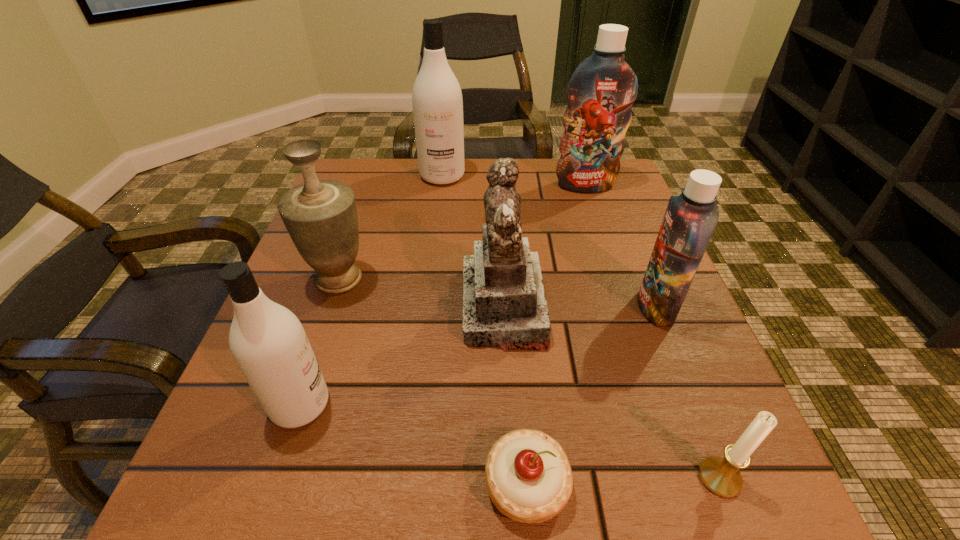
Where is `object that is at the near right corner`? This screenshot has width=960, height=540. object that is at the near right corner is located at coordinates (721, 476).

The image size is (960, 540). What are the coordinates of `free point at the far edge` in the screenshot? It's located at coord(538,167).

This screenshot has height=540, width=960. I want to click on vacant space at the left edge of the desktop, so click(x=382, y=231).

The image size is (960, 540). Identify the location of vacant space at the right edge of the desktop. (604, 282).

The height and width of the screenshot is (540, 960). Find the location of `vacant space at the near left corner`. vacant space at the near left corner is located at coordinates (263, 506).

Where is `free point between the figurine and the bigger white shampoo`? This screenshot has height=540, width=960. free point between the figurine and the bigger white shampoo is located at coordinates (473, 241).

Locate an element on the screen. free space between the smaller blue shampoo and the nearer white shampoo is located at coordinates (478, 355).

Locate an element on the screen. The image size is (960, 540). empty space between the farther white shampoo and the candle holder is located at coordinates (581, 327).

Find the location of `vacant area that lies between the bigger blue shampoo and the smaller blue shampoo`. vacant area that lies between the bigger blue shampoo and the smaller blue shampoo is located at coordinates (620, 246).

Locate an element on the screen. vacant area between the right white shampoo and the figurine is located at coordinates (473, 241).